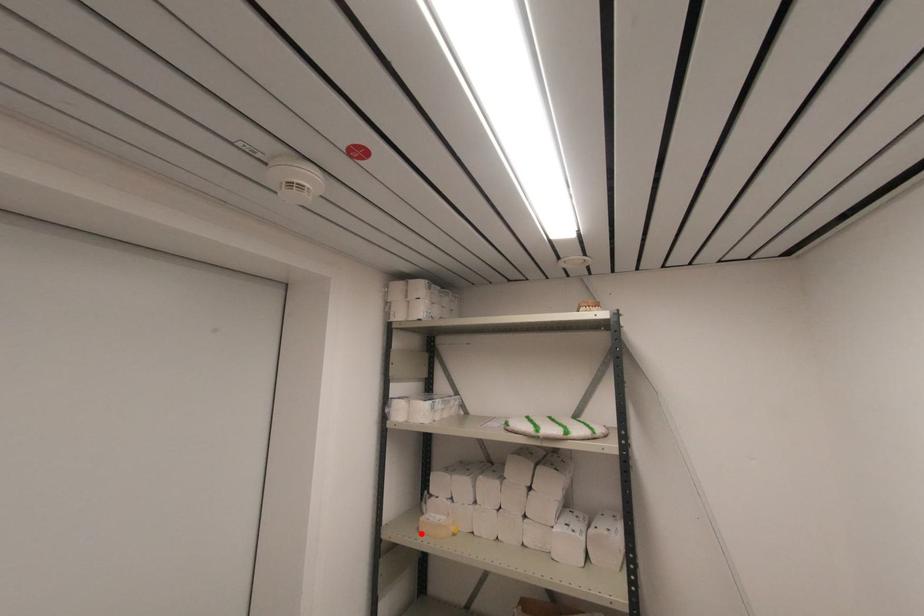
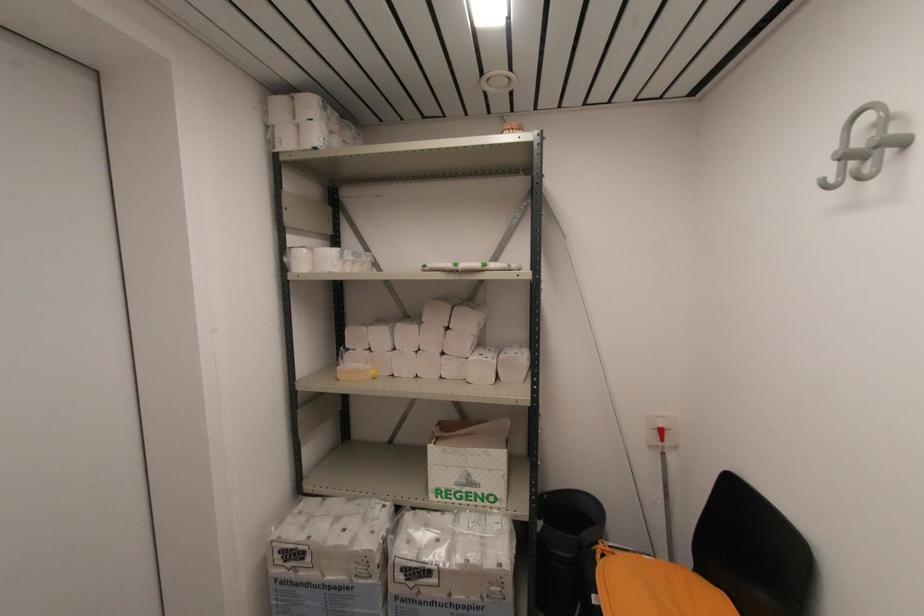
Where in the second image is the point corresponding to the highlighted location from the first image?

(339, 381)